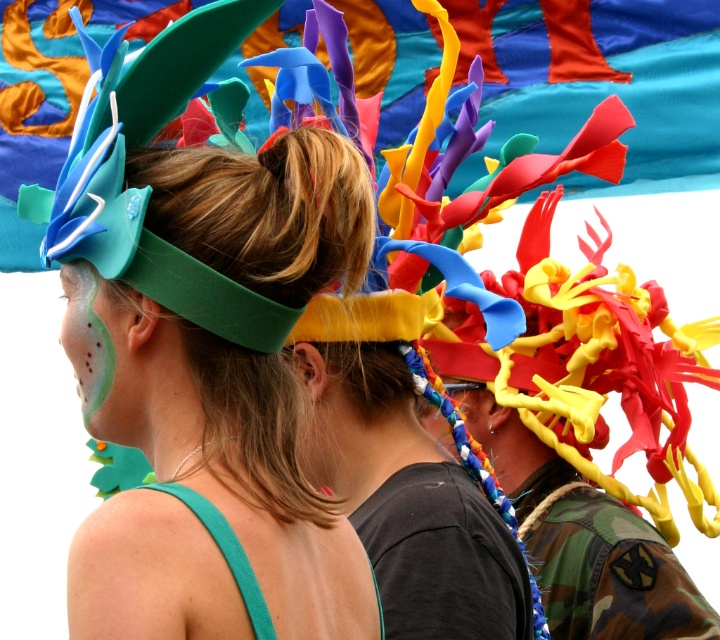
You are standing in front of the three individuals with colorful headpieces. You notice a specific point at coordinates point (252, 426). Which individual is this point located on?

The point (252, 426) is located on the brown hair at center, so it is on the middle individual.

You are an artist trying to locate the exact point on the green headband at center. Can you confirm if the point at coordinates (217,444) is indeed on the green headband at center?

Yes, the point at coordinates (217,444) is on the matte green headband at center according to the description.